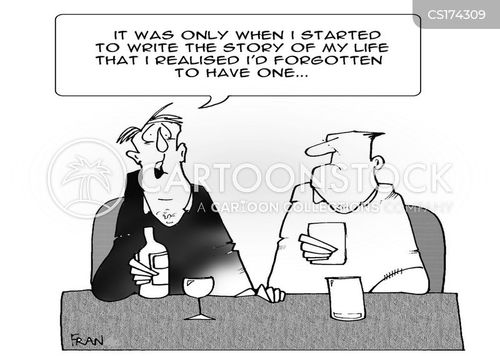
The width and height of the screenshot is (500, 356). Identify the location of chair. (430, 229), (100, 239).